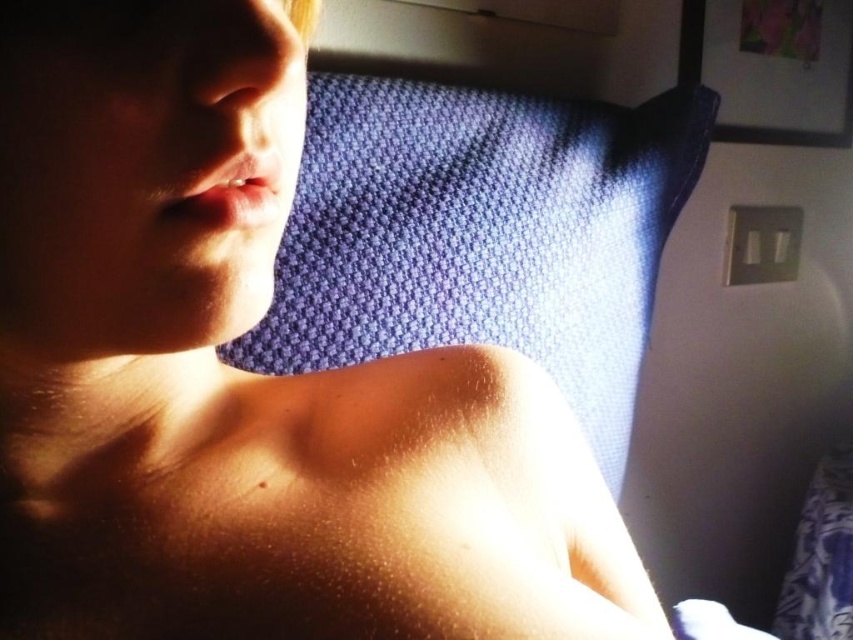
Question: Among these objects, which one is farthest from the camera?

Choices:
 (A) blue textured pillow at upper center
 (B) smooth skin at center

Answer: (A)

Question: Is smooth skin at center above blue textured pillow at upper center?

Choices:
 (A) yes
 (B) no

Answer: (B)

Question: Considering the relative positions of smooth skin at center and blue textured pillow at upper center in the image provided, where is smooth skin at center located with respect to blue textured pillow at upper center?

Choices:
 (A) above
 (B) below

Answer: (B)

Question: From the image, what is the correct spatial relationship of smooth skin at center in relation to blue textured pillow at upper center?

Choices:
 (A) above
 (B) below

Answer: (B)

Question: Which point is closer to the camera?

Choices:
 (A) blue textured pillow at upper center
 (B) smooth skin at center

Answer: (B)

Question: Which point appears closest to the camera in this image?

Choices:
 (A) (541, 433)
 (B) (283, 369)

Answer: (A)